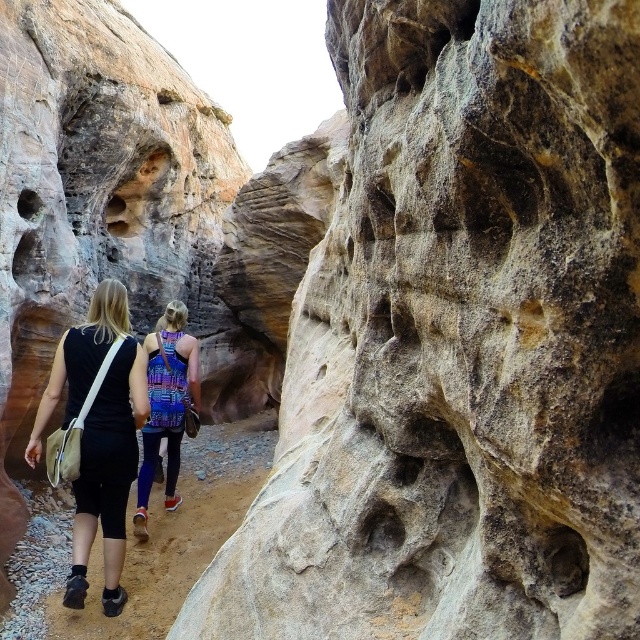
Is black fabric bag at center further to camera compared to multicolored fabric backpack at center?

No.

Is black fabric bag at center smaller than multicolored fabric backpack at center?

Correct, black fabric bag at center occupies less space than multicolored fabric backpack at center.

Find the location of `black fabric bag at center`. black fabric bag at center is located at coordinates (99, 435).